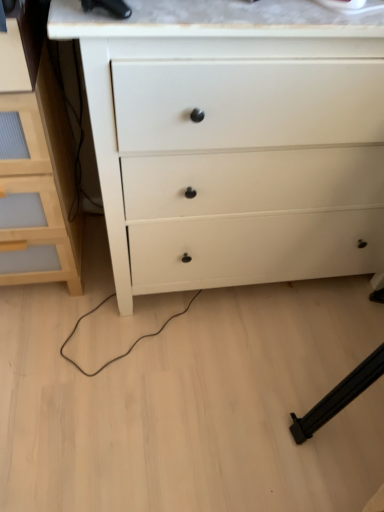
What is the approximate width of light wood chest of drawers at left, which is the 2th chest of drawers from right to left?

18.29 inches.

This screenshot has width=384, height=512. Describe the element at coordinates (34, 161) in the screenshot. I see `light wood chest of drawers at left, which is the first chest of drawers from left to right` at that location.

Locate an element on the screen. The width and height of the screenshot is (384, 512). light wood chest of drawers at left, which is the first chest of drawers from left to right is located at coordinates (34, 161).

Locate an element on the screen. white matte chest of drawers at center, the second chest of drawers viewed from the left is located at coordinates (233, 141).

Image resolution: width=384 pixels, height=512 pixels. Describe the element at coordinates (233, 141) in the screenshot. I see `white matte chest of drawers at center, marked as the 1th chest of drawers in a right-to-left arrangement` at that location.

Find the location of `light wood chest of drawers at left, which is the 2th chest of drawers from right to left`. light wood chest of drawers at left, which is the 2th chest of drawers from right to left is located at coordinates (34, 161).

From the picture: Is white matte chest of drawers at center, the second chest of drawers viewed from the left, at the right side of light wood chest of drawers at left, which is the first chest of drawers from left to right?

Yes, white matte chest of drawers at center, the second chest of drawers viewed from the left, is to the right of light wood chest of drawers at left, which is the first chest of drawers from left to right.

Is the depth of white matte chest of drawers at center, marked as the 1th chest of drawers in a right-to-left arrangement, less than that of light wood chest of drawers at left, which is the 2th chest of drawers from right to left?

Yes, the depth of white matte chest of drawers at center, marked as the 1th chest of drawers in a right-to-left arrangement, is less than that of light wood chest of drawers at left, which is the 2th chest of drawers from right to left.

Which is more distant, (190, 116) or (38, 268)?

The point (38, 268) is farther.

From the image's perspective, would you say white matte chest of drawers at center, the second chest of drawers viewed from the left, is shown under light wood chest of drawers at left, which is the first chest of drawers from left to right?

Actually, white matte chest of drawers at center, the second chest of drawers viewed from the left, appears above light wood chest of drawers at left, which is the first chest of drawers from left to right, in the image.

From a real-world perspective, is white matte chest of drawers at center, marked as the 1th chest of drawers in a right-to-left arrangement, physically located above or below light wood chest of drawers at left, which is the 2th chest of drawers from right to left?

white matte chest of drawers at center, marked as the 1th chest of drawers in a right-to-left arrangement, is above light wood chest of drawers at left, which is the 2th chest of drawers from right to left.

Between white matte chest of drawers at center, the second chest of drawers viewed from the left, and light wood chest of drawers at left, which is the 2th chest of drawers from right to left, which one has larger width?

Wider between the two is white matte chest of drawers at center, the second chest of drawers viewed from the left.

Can you confirm if white matte chest of drawers at center, the second chest of drawers viewed from the left, is taller than light wood chest of drawers at left, which is the first chest of drawers from left to right?

Correct, white matte chest of drawers at center, the second chest of drawers viewed from the left, is much taller as light wood chest of drawers at left, which is the first chest of drawers from left to right.

Considering the sizes of objects white matte chest of drawers at center, marked as the 1th chest of drawers in a right-to-left arrangement, and light wood chest of drawers at left, which is the first chest of drawers from left to right, in the image provided, who is smaller, white matte chest of drawers at center, marked as the 1th chest of drawers in a right-to-left arrangement, or light wood chest of drawers at left, which is the first chest of drawers from left to right,?

light wood chest of drawers at left, which is the first chest of drawers from left to right, is smaller.

Is white matte chest of drawers at center, the second chest of drawers viewed from the left, not within light wood chest of drawers at left, which is the first chest of drawers from left to right?

Yes.

Is white matte chest of drawers at center, the second chest of drawers viewed from the left, far from light wood chest of drawers at left, which is the first chest of drawers from left to right?

white matte chest of drawers at center, the second chest of drawers viewed from the left, is actually quite close to light wood chest of drawers at left, which is the first chest of drawers from left to right.

Based on the photo, is white matte chest of drawers at center, marked as the 1th chest of drawers in a right-to-left arrangement, aimed at light wood chest of drawers at left, which is the 2th chest of drawers from right to left?

No.

How many degrees apart are the facing directions of white matte chest of drawers at center, marked as the 1th chest of drawers in a right-to-left arrangement, and light wood chest of drawers at left, which is the 2th chest of drawers from right to left?

There is a 0.0466-degree angle between the facing directions of white matte chest of drawers at center, marked as the 1th chest of drawers in a right-to-left arrangement, and light wood chest of drawers at left, which is the 2th chest of drawers from right to left.

At what (x,y) coordinates should I click in order to perform the action: click on chest of drawers lying on the right of light wood chest of drawers at left, which is the 2th chest of drawers from right to left. Please return your answer as a coordinate pair (x, y). This screenshot has width=384, height=512. Looking at the image, I should click on (233, 141).

Considering the relative positions of light wood chest of drawers at left, which is the 2th chest of drawers from right to left, and white matte chest of drawers at center, marked as the 1th chest of drawers in a right-to-left arrangement, in the image provided, is light wood chest of drawers at left, which is the 2th chest of drawers from right to left, to the left or to the right of white matte chest of drawers at center, marked as the 1th chest of drawers in a right-to-left arrangement,?

Based on their positions, light wood chest of drawers at left, which is the 2th chest of drawers from right to left, is located to the left of white matte chest of drawers at center, marked as the 1th chest of drawers in a right-to-left arrangement.

From the picture: Considering their positions, is light wood chest of drawers at left, which is the first chest of drawers from left to right, located in front of or behind white matte chest of drawers at center, marked as the 1th chest of drawers in a right-to-left arrangement?

In the image, light wood chest of drawers at left, which is the first chest of drawers from left to right, appears behind white matte chest of drawers at center, marked as the 1th chest of drawers in a right-to-left arrangement.

Which is further, [35,173] or [184,209]?

Positioned behind is point [184,209].

From the image's perspective, which is below, light wood chest of drawers at left, which is the first chest of drawers from left to right, or white matte chest of drawers at center, the second chest of drawers viewed from the left?

From the image's view, light wood chest of drawers at left, which is the first chest of drawers from left to right, is below.

From a real-world perspective, is light wood chest of drawers at left, which is the first chest of drawers from left to right, physically located above or below white matte chest of drawers at center, marked as the 1th chest of drawers in a right-to-left arrangement?

Clearly, from a real-world perspective, light wood chest of drawers at left, which is the first chest of drawers from left to right, is below white matte chest of drawers at center, marked as the 1th chest of drawers in a right-to-left arrangement.

Can you confirm if light wood chest of drawers at left, which is the 2th chest of drawers from right to left, is wider than white matte chest of drawers at center, the second chest of drawers viewed from the left?

In fact, light wood chest of drawers at left, which is the 2th chest of drawers from right to left, might be narrower than white matte chest of drawers at center, the second chest of drawers viewed from the left.

Can you confirm if light wood chest of drawers at left, which is the 2th chest of drawers from right to left, is shorter than white matte chest of drawers at center, marked as the 1th chest of drawers in a right-to-left arrangement?

Correct, light wood chest of drawers at left, which is the 2th chest of drawers from right to left, is not as tall as white matte chest of drawers at center, marked as the 1th chest of drawers in a right-to-left arrangement.

Who is bigger, light wood chest of drawers at left, which is the 2th chest of drawers from right to left, or white matte chest of drawers at center, the second chest of drawers viewed from the left?

Result: white matte chest of drawers at center, the second chest of drawers viewed from the left.

Is white matte chest of drawers at center, the second chest of drawers viewed from the left, inside light wood chest of drawers at left, which is the 2th chest of drawers from right to left?

Definitely not — white matte chest of drawers at center, the second chest of drawers viewed from the left, is not inside light wood chest of drawers at left, which is the 2th chest of drawers from right to left.

Is the surface of light wood chest of drawers at left, which is the 2th chest of drawers from right to left, in direct contact with white matte chest of drawers at center, marked as the 1th chest of drawers in a right-to-left arrangement?

No, light wood chest of drawers at left, which is the 2th chest of drawers from right to left, is not touching white matte chest of drawers at center, marked as the 1th chest of drawers in a right-to-left arrangement.

Is light wood chest of drawers at left, which is the first chest of drawers from left to right, turned away from white matte chest of drawers at center, the second chest of drawers viewed from the left?

That's not correct — light wood chest of drawers at left, which is the first chest of drawers from left to right, is not looking away from white matte chest of drawers at center, the second chest of drawers viewed from the left.

What's the angular difference between light wood chest of drawers at left, which is the 2th chest of drawers from right to left, and white matte chest of drawers at center, marked as the 1th chest of drawers in a right-to-left arrangement,'s facing directions?

light wood chest of drawers at left, which is the 2th chest of drawers from right to left, and white matte chest of drawers at center, marked as the 1th chest of drawers in a right-to-left arrangement, are facing 0.0466 degrees away from each other.

What are the coordinates of `the chest of drawers that is above the light wood chest of drawers at left, which is the 2th chest of drawers from right to left (from the image's perspective)` in the screenshot? It's located at 233,141.

Find the location of a particular element. the chest of drawers lying below the white matte chest of drawers at center, the second chest of drawers viewed from the left (from the image's perspective) is located at coordinates (34, 161).

This screenshot has height=512, width=384. Find the location of `the chest of drawers located above the light wood chest of drawers at left, which is the 2th chest of drawers from right to left (from the image's perspective)`. the chest of drawers located above the light wood chest of drawers at left, which is the 2th chest of drawers from right to left (from the image's perspective) is located at coordinates (233, 141).